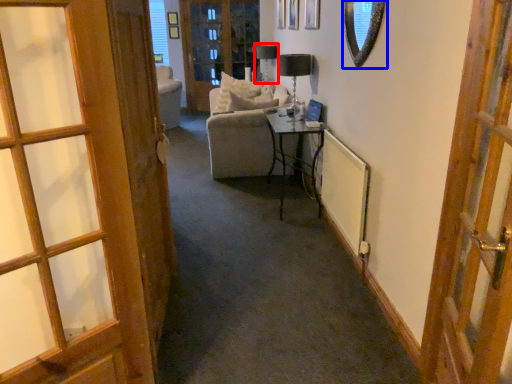
Question: Which object is closer to the camera taking this photo, table lamp (highlighted by a red box) or mirror (highlighted by a blue box)?

Choices:
 (A) table lamp
 (B) mirror

Answer: (B)